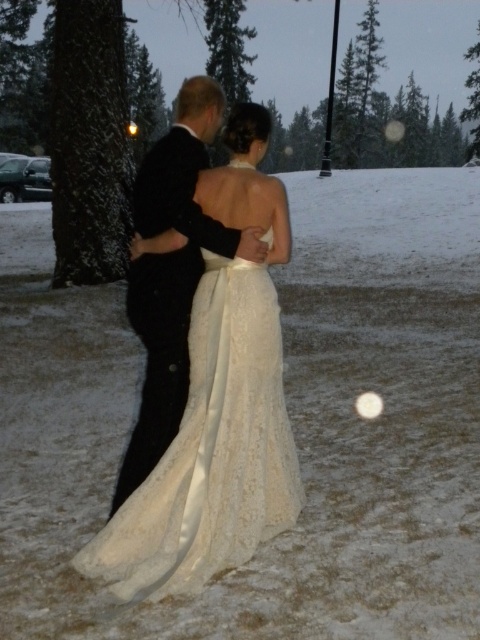
You are a photographer at a wedding. You need to capture a photo of the lace satin dress at center and the black satin suit at center. Based on their positions, which one is positioned to the right side of the other?

The lace satin dress at center is positioned to the right of the black satin suit at center.

You are a photographer at a wedding. You need to adjust your camera focus to capture both the lace satin dress at center and the black satin suit at center clearly. Based on their positions, which one should you focus on first to ensure proper depth of field?

The lace satin dress at center is located below the black satin suit at center. Since the dress is lower in the frame, focusing on the black satin suit at center first would ensure the upper part of the couple is sharp, and the dress will naturally fall within the depth of field range.